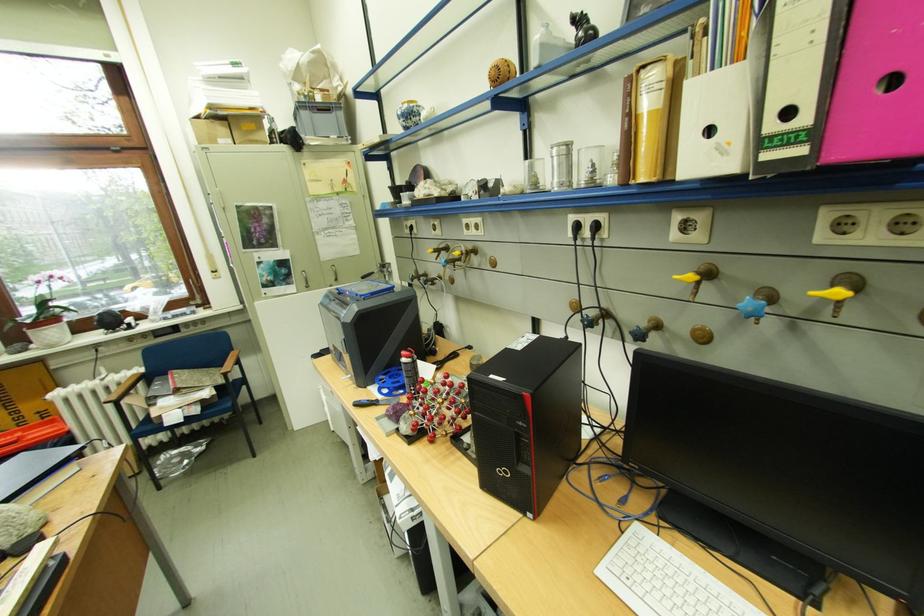
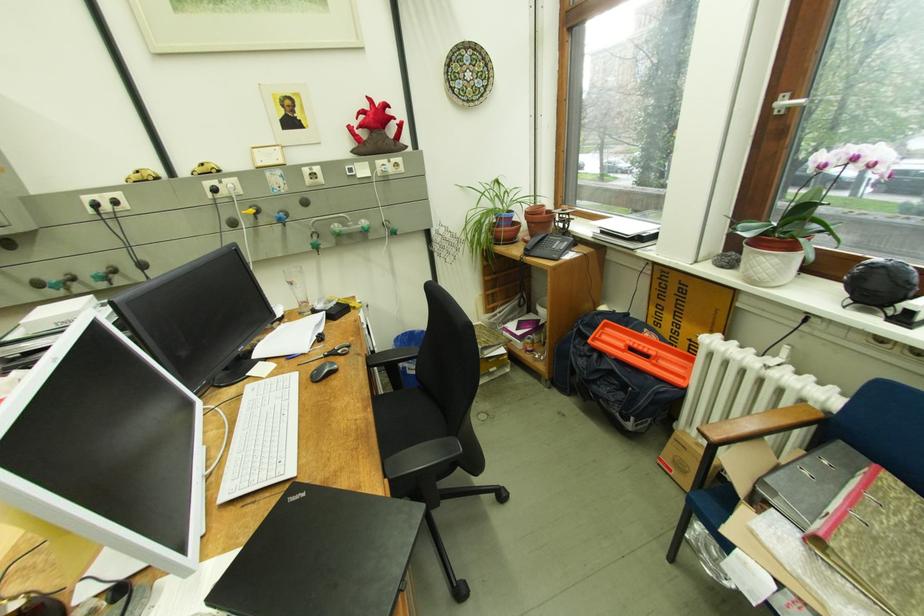
Find the pixel in the second image that matches point 159,397 in the first image.

(777, 482)